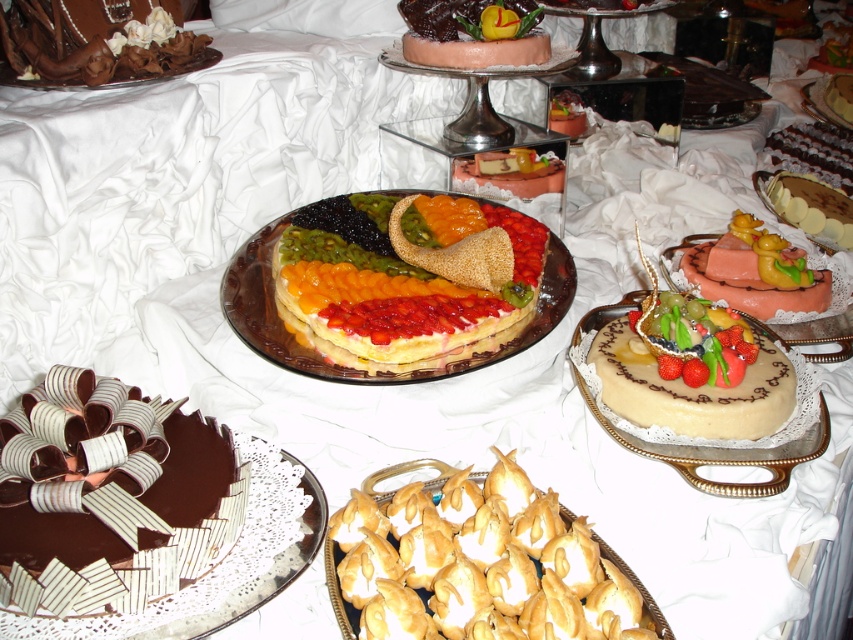
Looking at this image, you are a guest at a wedding and you want to take a photo with the desserts. The photographer tells you to stand to the right of the pink frosted cake at center and to the left of the smooth chocolate cake at center. Is this possible?

Yes, because the pink frosted cake at center is to the left of the smooth chocolate cake at center, so there is space between them where you can stand.

You are a guest at the dessert table and want to grab the yellow rubber duck at center. Considering you can only reach 4 feet, can you easily pick it up without moving your position?

The yellow rubber duck at center is 4.86 feet away from the viewer, which is beyond your reach of 4 feet. You would need to move closer to grab it.